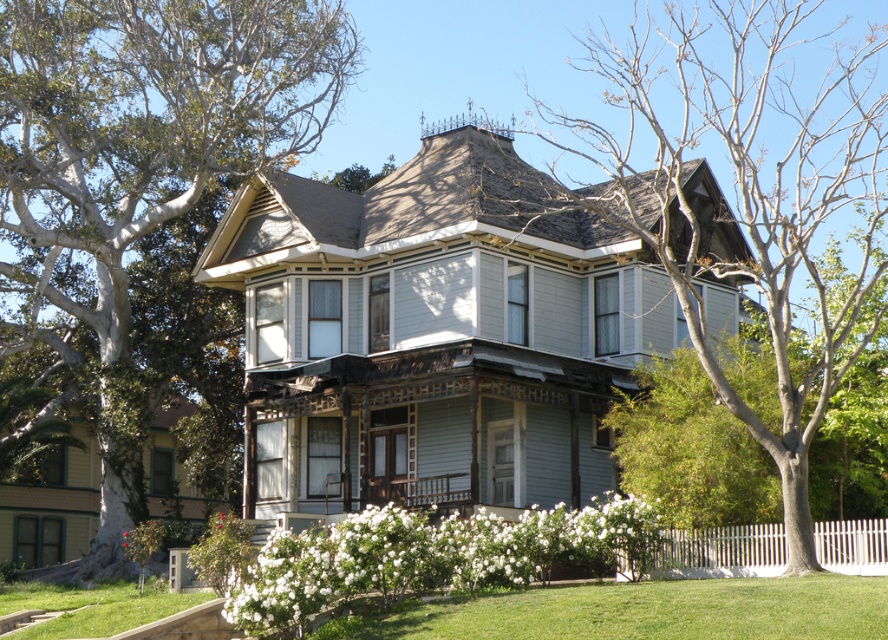
Question: Which object appears closest to the camera in this image?

Choices:
 (A) bare branches at upper center
 (B) white picket fence at lower right
 (C) smooth gray bark at upper left
 (D) green grass at lower center

Answer: (D)

Question: Observing the image, what is the correct spatial positioning of smooth gray bark at upper left in reference to bare branches at upper center?

Choices:
 (A) right
 (B) left

Answer: (B)

Question: Does bare branches at upper center appear on the left side of white picket fence at lower right?

Choices:
 (A) yes
 (B) no

Answer: (B)

Question: Which object appears farthest from the camera in this image?

Choices:
 (A) green grass at lower center
 (B) smooth gray bark at upper left
 (C) white picket fence at lower right

Answer: (B)

Question: Which object appears farthest from the camera in this image?

Choices:
 (A) smooth gray bark at upper left
 (B) green grass at lower center
 (C) white picket fence at lower right
 (D) bare branches at upper center

Answer: (A)

Question: Observing the image, what is the correct spatial positioning of smooth gray bark at upper left in reference to green grass at lower center?

Choices:
 (A) below
 (B) above

Answer: (B)